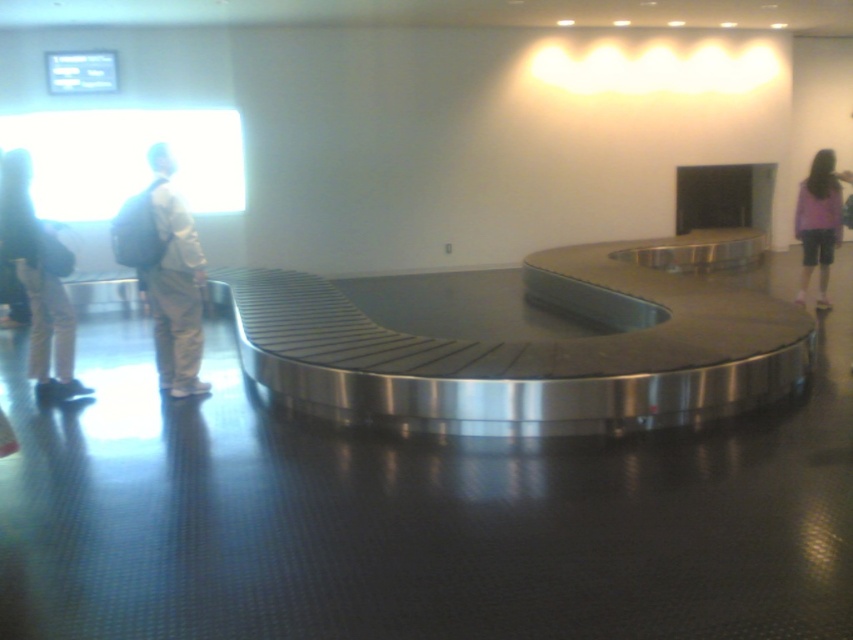
Who is positioned more to the left, matte khaki pants at left or purple fabric shorts at right?

Positioned to the left is matte khaki pants at left.

Is matte khaki pants at left closer to the viewer compared to purple fabric shorts at right?

Yes, matte khaki pants at left is in front of purple fabric shorts at right.

Locate an element on the screen. The height and width of the screenshot is (640, 853). matte khaki pants at left is located at coordinates (173, 284).

Can you confirm if matte black backpack at left is smaller than matte khaki pants at left?

Yes, matte black backpack at left is smaller than matte khaki pants at left.

Between matte black backpack at left and matte khaki pants at left, which one is positioned higher?

matte khaki pants at left is above.

You are a GUI agent. You are given a task and a screenshot of the screen. Output one action in this format:
    pyautogui.click(x=<x>, y=<y>)
    Task: Click on the matte black backpack at left
    
    Given the screenshot: What is the action you would take?
    pyautogui.click(x=38, y=280)

At what (x,y) coordinates should I click in order to perform the action: click on matte black backpack at left. Please return your answer as a coordinate pair (x, y). The image size is (853, 640). Looking at the image, I should click on (38, 280).

The height and width of the screenshot is (640, 853). What do you see at coordinates (38, 280) in the screenshot? I see `matte black backpack at left` at bounding box center [38, 280].

This screenshot has width=853, height=640. What do you see at coordinates (38, 280) in the screenshot?
I see `matte black backpack at left` at bounding box center [38, 280].

This screenshot has width=853, height=640. I want to click on matte black backpack at left, so click(x=38, y=280).